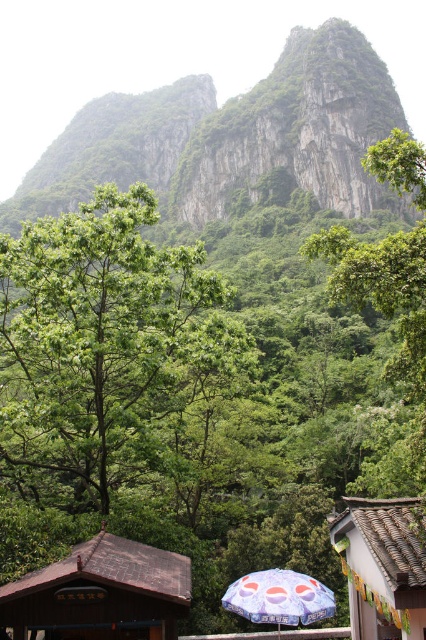
Between green rocky mountain at upper center and blue printed umbrella at lower center, which one is positioned higher?

green rocky mountain at upper center is higher up.

Consider the image. Can you confirm if green rocky mountain at upper center is smaller than blue printed umbrella at lower center?

Incorrect, green rocky mountain at upper center is not smaller in size than blue printed umbrella at lower center.

Which is behind, point (235, 182) or point (301, 612)?

Positioned behind is point (235, 182).

The width and height of the screenshot is (426, 640). What are the coordinates of `green rocky mountain at upper center` in the screenshot? It's located at (230, 136).

Between green leafy tree at center and green rocky mountain at upper center, which one appears on the right side from the viewer's perspective?

green leafy tree at center is more to the right.

Can you confirm if green leafy tree at center is wider than green rocky mountain at upper center?

No.

Between point (115, 205) and point (259, 152), which one is positioned behind?

The point (259, 152) is more distant.

Locate an element on the screen. The height and width of the screenshot is (640, 426). green leafy tree at center is located at coordinates (104, 348).

Can you confirm if brown wooden hut at lower left is thinner than brown tile roof at lower right?

In fact, brown wooden hut at lower left might be wider than brown tile roof at lower right.

Does brown wooden hut at lower left have a larger size compared to brown tile roof at lower right?

Incorrect, brown wooden hut at lower left is not larger than brown tile roof at lower right.

The height and width of the screenshot is (640, 426). I want to click on brown wooden hut at lower left, so click(x=100, y=593).